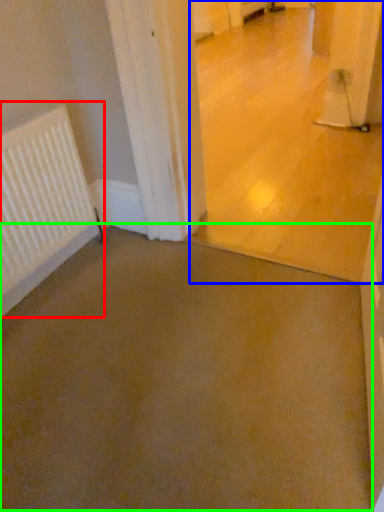
Question: Which object is positioned farthest from radiator (highlighted by a red box)? Select from concrete (highlighted by a blue box) and concrete (highlighted by a green box).

Choices:
 (A) concrete
 (B) concrete

Answer: (A)